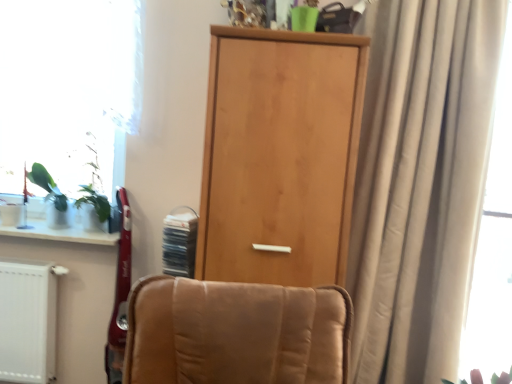
Question: Are light wood door at center and white glossy window sill at lower left far apart?

Choices:
 (A) yes
 (B) no

Answer: (B)

Question: From the image's perspective, does light wood door at center appear lower than white glossy window sill at lower left?

Choices:
 (A) yes
 (B) no

Answer: (B)

Question: From a real-world perspective, is light wood door at center located higher than white glossy window sill at lower left?

Choices:
 (A) yes
 (B) no

Answer: (A)

Question: Does light wood door at center come in front of white glossy window sill at lower left?

Choices:
 (A) no
 (B) yes

Answer: (B)

Question: Is light wood door at center taller than white glossy window sill at lower left?

Choices:
 (A) no
 (B) yes

Answer: (B)

Question: Would you say white glossy window sill at lower left is part of light wood door at center's contents?

Choices:
 (A) yes
 (B) no

Answer: (B)

Question: Are beige fabric curtain at right and transparent glass window at left making contact?

Choices:
 (A) no
 (B) yes

Answer: (A)

Question: Does beige fabric curtain at right have a greater width compared to transparent glass window at left?

Choices:
 (A) no
 (B) yes

Answer: (B)

Question: Is beige fabric curtain at right thinner than transparent glass window at left?

Choices:
 (A) no
 (B) yes

Answer: (A)

Question: Is beige fabric curtain at right closer to the viewer compared to transparent glass window at left?

Choices:
 (A) yes
 (B) no

Answer: (A)

Question: Can you confirm if beige fabric curtain at right is shorter than transparent glass window at left?

Choices:
 (A) no
 (B) yes

Answer: (A)

Question: Is beige fabric curtain at right far away from transparent glass window at left?

Choices:
 (A) no
 (B) yes

Answer: (B)

Question: Are beige fabric curtain at right and light wood door at center making contact?

Choices:
 (A) yes
 (B) no

Answer: (B)